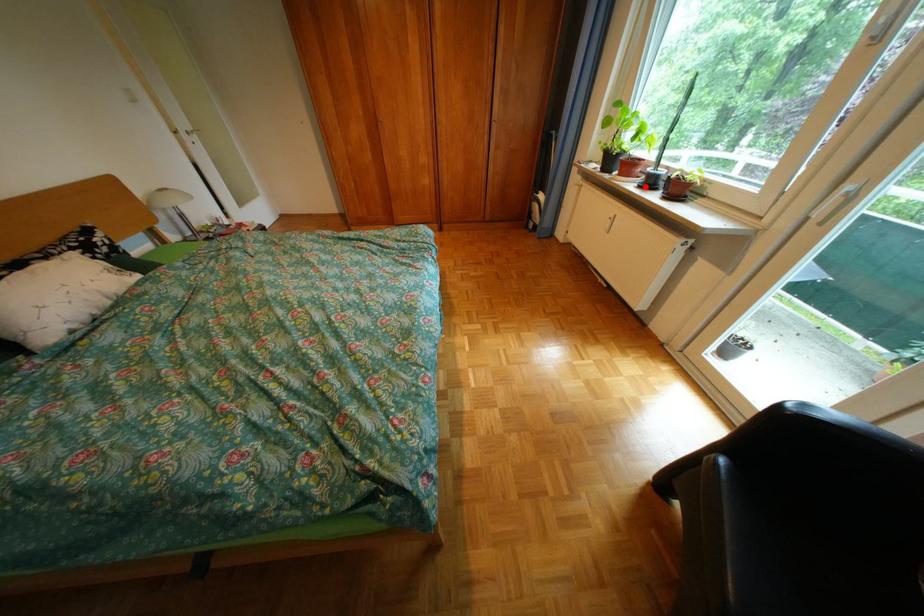
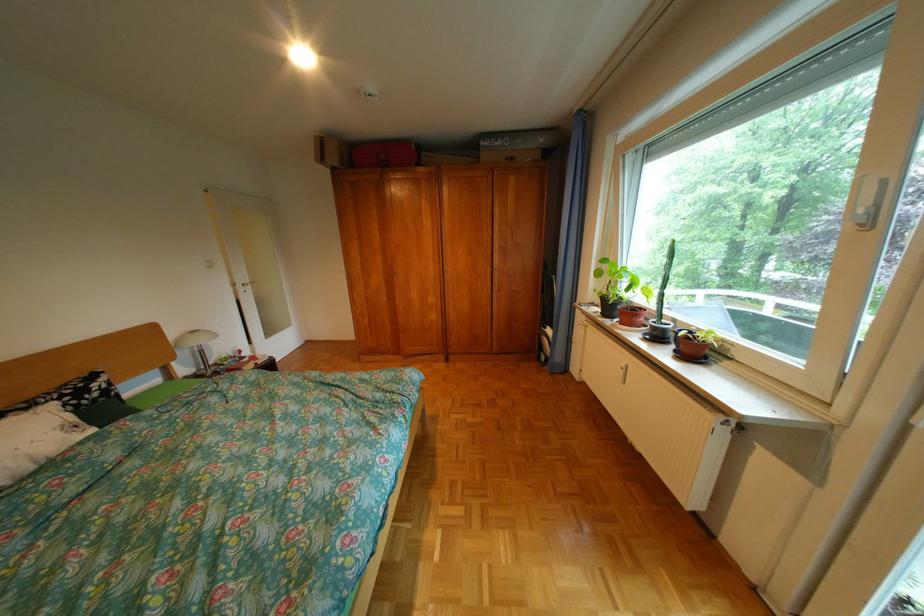
In the second image, find the point that corresponds to the highlighted location in the first image.

(650, 338)